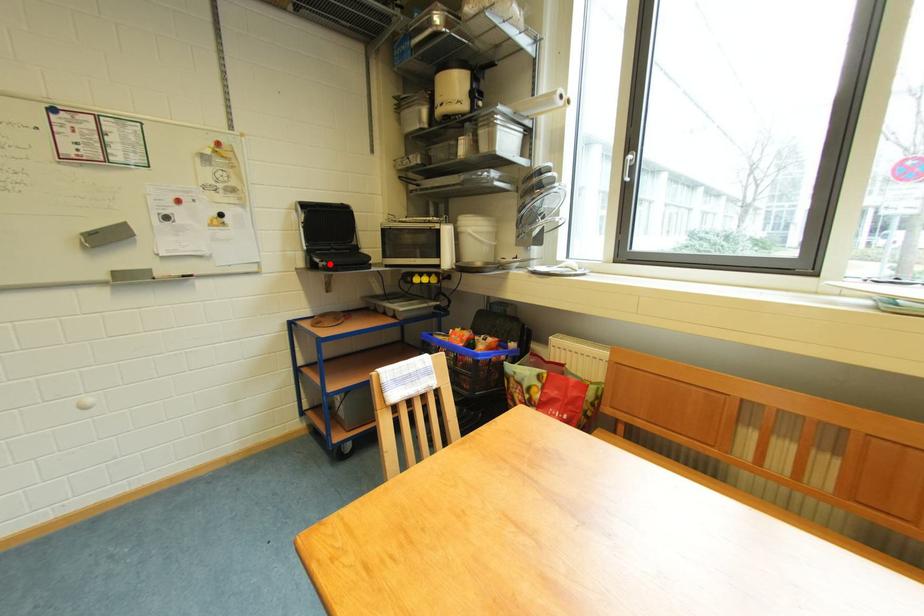
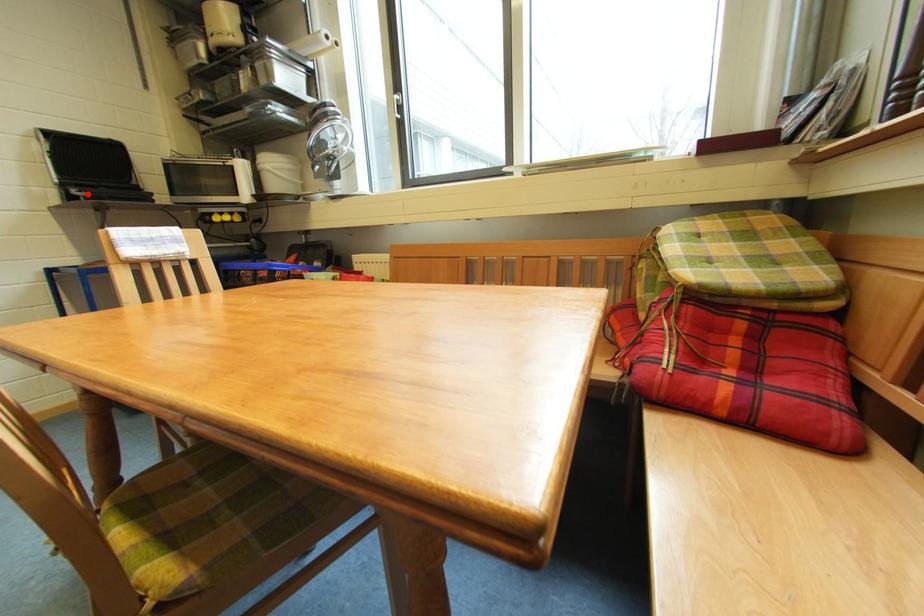
Consider the image. I am providing you with two images of the same scene from different viewpoints. A red point is marked on the first image and another point is marked on the second image. Is the red point in image1 aligned with the point shown in image2?

Yes